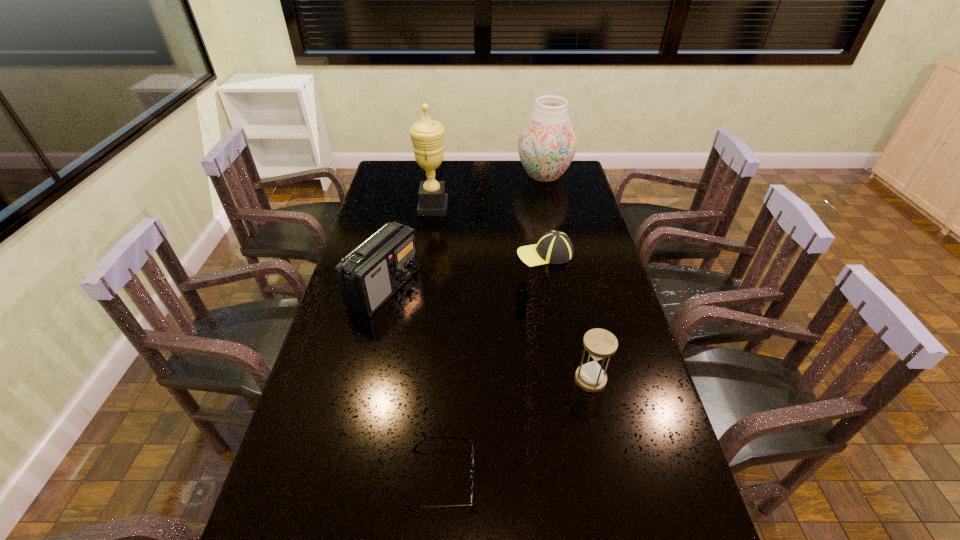
This screenshot has width=960, height=540. Identify the location of the closest object to the fifth shortest object. (427, 135).

Choose which object is the second nearest neighbor to the baseball cap. Please provide its 2D coordinates. Your answer should be formatted as a tuple, i.e. [(x, y)], where the tuple contains the x and y coordinates of a point satisfying the conditions above.

[(427, 135)]

Identify the location of blank area in the image that satisfies the following two spatial constraints: 1. on the front side of the vase; 2. with the brim of the baseball cap facing forward. (561, 254).

This screenshot has width=960, height=540. In order to click on vacant space that satisfies the following two spatial constraints: 1. on the front panel of the fourth shortest object; 2. on the left side of the radio receiver in this screenshot , I will do `click(363, 379)`.